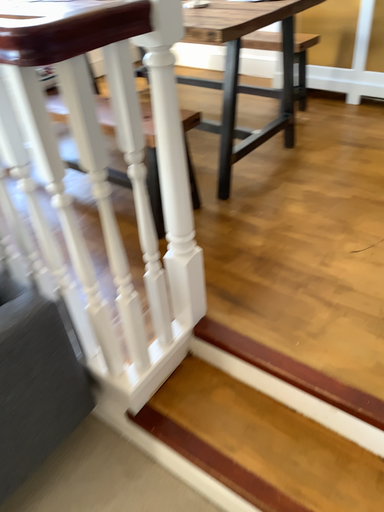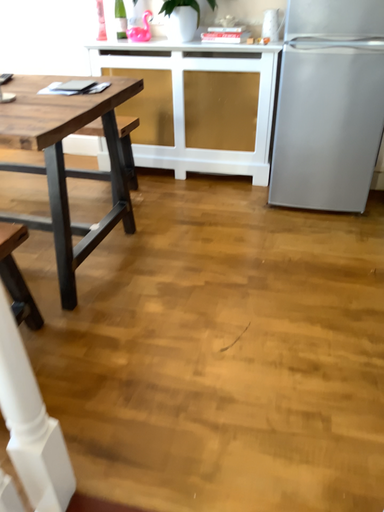
Question: Which way did the camera rotate in the video?

Choices:
 (A) rotated right
 (B) rotated left

Answer: (A)